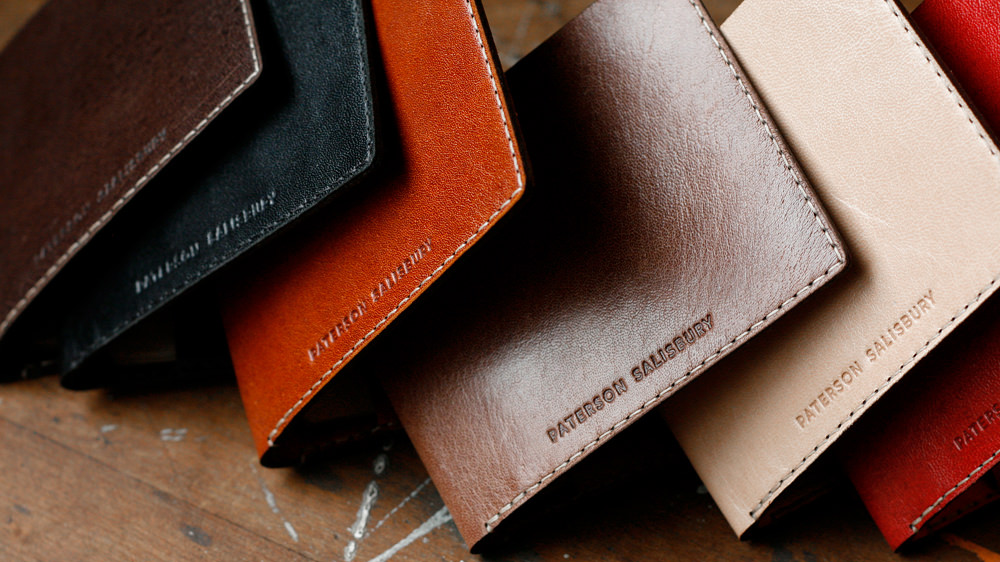
Identify the location of table. (275, 471).